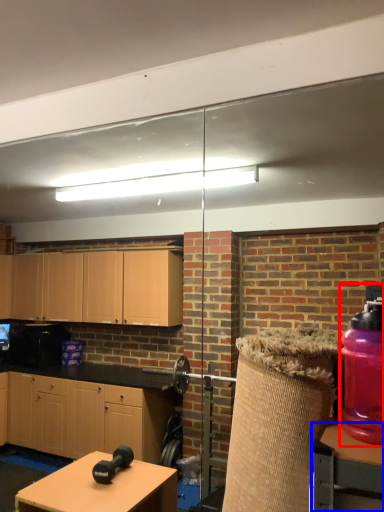
Question: Which point is closer to the camera, bottle (highlighted by a red box) or table (highlighted by a blue box)?

Choices:
 (A) bottle
 (B) table

Answer: (B)